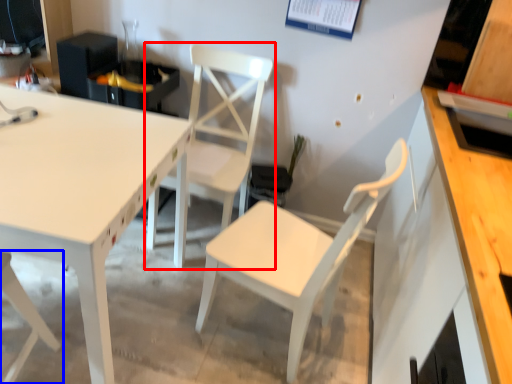
Question: Which object is closer to the camera taking this photo, chair (highlighted by a red box) or chair (highlighted by a blue box)?

Choices:
 (A) chair
 (B) chair

Answer: (B)